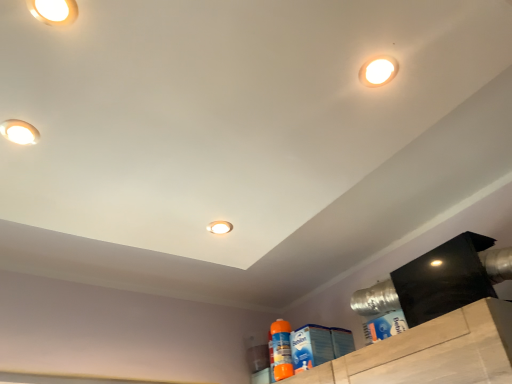
Question: Is orange plastic spray bottle at lower right, which is the 1th cleaning product in bottom-to-top order, at the back of matte white droplight at upper left, which is counted as the fourth droplight, starting from the back?

Choices:
 (A) yes
 (B) no

Answer: (B)

Question: Is matte white droplight at upper left, placed as the third droplight when sorted from right to left, positioned behind orange plastic spray bottle at lower right, the first cleaning product when ordered from left to right?

Choices:
 (A) yes
 (B) no

Answer: (B)

Question: From the image's perspective, is matte white droplight at upper left, which is counted as the fourth droplight, starting from the back, located beneath orange plastic spray bottle at lower right, the second cleaning product when ordered from right to left?

Choices:
 (A) no
 (B) yes

Answer: (A)

Question: Could you tell me if matte white droplight at upper left, the 2th droplight positioned from the left, is facing orange plastic spray bottle at lower right, which is the 1th cleaning product in bottom-to-top order?

Choices:
 (A) yes
 (B) no

Answer: (B)

Question: Considering the relative positions of matte white droplight at upper left, which is the 1th droplight from top to bottom, and orange plastic spray bottle at lower right, positioned as the first cleaning product in back-to-front order, in the image provided, is matte white droplight at upper left, which is the 1th droplight from top to bottom, to the left of orange plastic spray bottle at lower right, positioned as the first cleaning product in back-to-front order, from the viewer's perspective?

Choices:
 (A) yes
 (B) no

Answer: (A)

Question: Considering their positions, is white glossy droplight at upper right, the 2th droplight when ordered from top to bottom, located in front of or behind matte white droplight at upper left, marked as the 4th droplight in a bottom-to-top arrangement?

Choices:
 (A) behind
 (B) front

Answer: (A)

Question: Considering the positions of white glossy droplight at upper right, the 2th droplight when ordered from top to bottom, and matte white droplight at upper left, which is the 1th droplight from top to bottom, in the image, is white glossy droplight at upper right, the 2th droplight when ordered from top to bottom, taller or shorter than matte white droplight at upper left, which is the 1th droplight from top to bottom,?

Choices:
 (A) tall
 (B) short

Answer: (A)

Question: Looking at their shapes, would you say white glossy droplight at upper right, which appears as the 1th droplight when viewed from the right, is wider or thinner than matte white droplight at upper left, which is the 1th droplight from top to bottom?

Choices:
 (A) wide
 (B) thin

Answer: (B)

Question: In terms of size, does white glossy droplight at upper right, arranged as the third droplight when ordered from the bottom, appear bigger or smaller than matte white droplight at upper left, marked as the 1th droplight in a front-to-back arrangement?

Choices:
 (A) big
 (B) small

Answer: (A)

Question: Is matte white droplight at upper left, which is counted as the fourth droplight, starting from the back, in front of or behind orange plastic spray bottle at lower right, which appears as the second cleaning product when viewed from the top, in the image?

Choices:
 (A) behind
 (B) front

Answer: (B)

Question: Considering the positions of point (31, 6) and point (274, 357), is point (31, 6) closer or farther from the camera than point (274, 357)?

Choices:
 (A) farther
 (B) closer

Answer: (B)

Question: From the image's perspective, relative to orange plastic spray bottle at lower right, which is the 2th cleaning product from front to back, is matte white droplight at upper left, marked as the 4th droplight in a bottom-to-top arrangement, above or below?

Choices:
 (A) above
 (B) below

Answer: (A)

Question: In terms of height, does matte white droplight at upper left, placed as the third droplight when sorted from right to left, look taller or shorter compared to orange plastic spray bottle at lower right, which is the 1th cleaning product in bottom-to-top order?

Choices:
 (A) tall
 (B) short

Answer: (B)

Question: In the image, is white glossy droplight at upper right, arranged as the third droplight when ordered from the bottom, on the left side or the right side of matte white droplight at upper left, the first droplight positioned from the left?

Choices:
 (A) left
 (B) right

Answer: (B)

Question: From the image's perspective, relative to matte white droplight at upper left, the first droplight positioned from the left, is white glossy droplight at upper right, which is counted as the second droplight, starting from the front, above or below?

Choices:
 (A) above
 (B) below

Answer: (A)